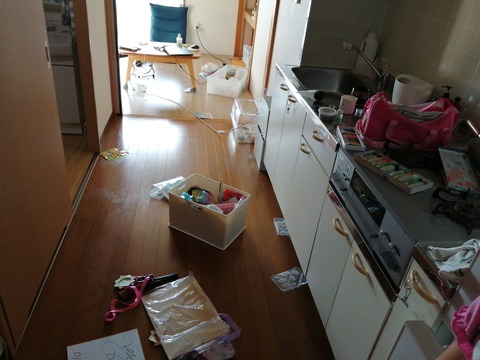
What are the coordinates of `counter top` in the screenshot? It's located at (423, 226).